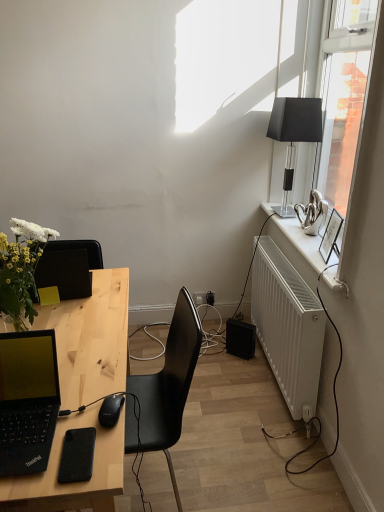
This screenshot has width=384, height=512. In order to click on free space in front of black plastic speaker at lower right in this screenshot , I will do `click(245, 367)`.